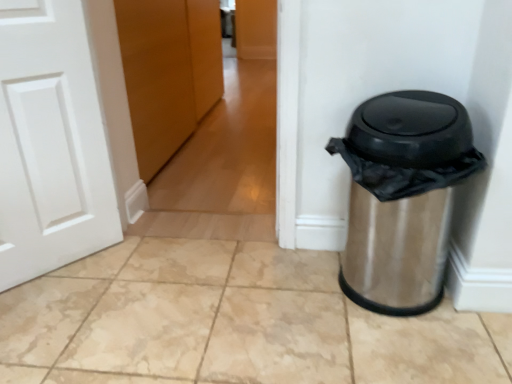
The height and width of the screenshot is (384, 512). In order to click on vacant area that is in front of stainless steel trash can at right in this screenshot , I will do `click(401, 350)`.